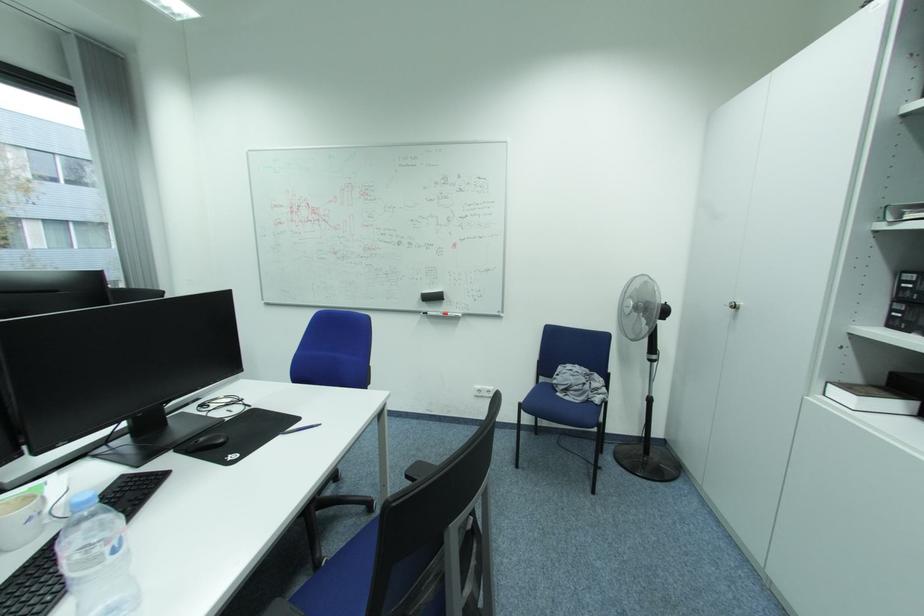
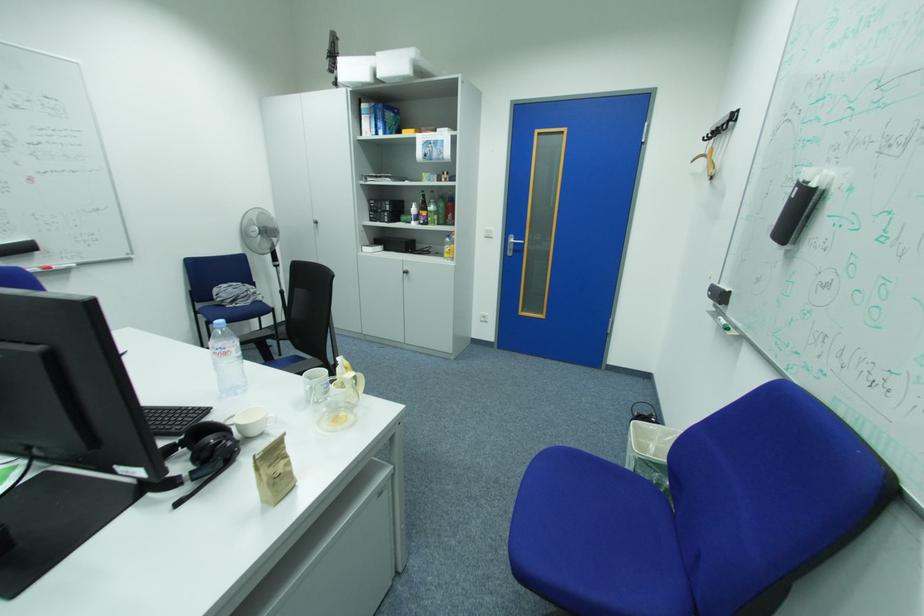
In the second image, find the point that corresponds to (x=458, y=217) in the first image.

(14, 140)